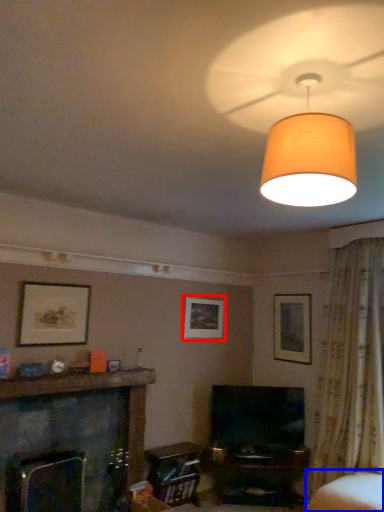
Question: Among these objects, which one is nearest to the camera, picture frame (highlighted by a red box) or swivel chair (highlighted by a blue box)?

Choices:
 (A) picture frame
 (B) swivel chair

Answer: (B)